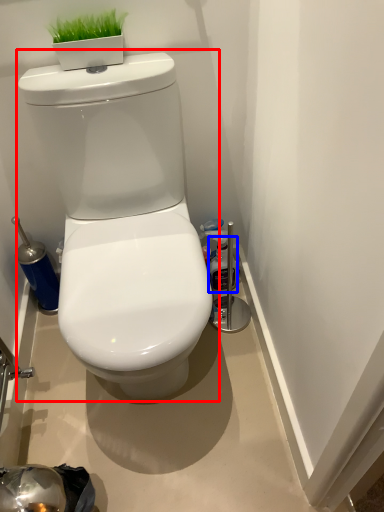
Question: Which object appears farthest to the camera in this image, toilet (highlighted by a red box) or bottle (highlighted by a blue box)?

Choices:
 (A) toilet
 (B) bottle

Answer: (B)